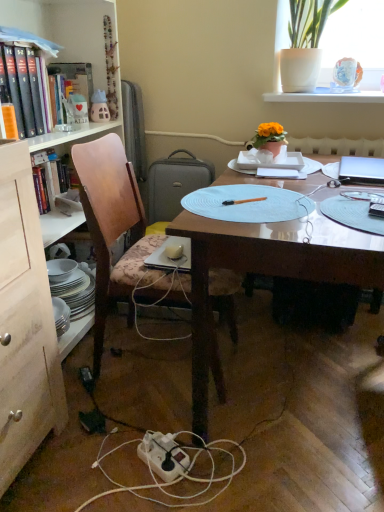
Where is `free space in front of white plastic power outlet at lower center`? free space in front of white plastic power outlet at lower center is located at coordinates pos(156,493).